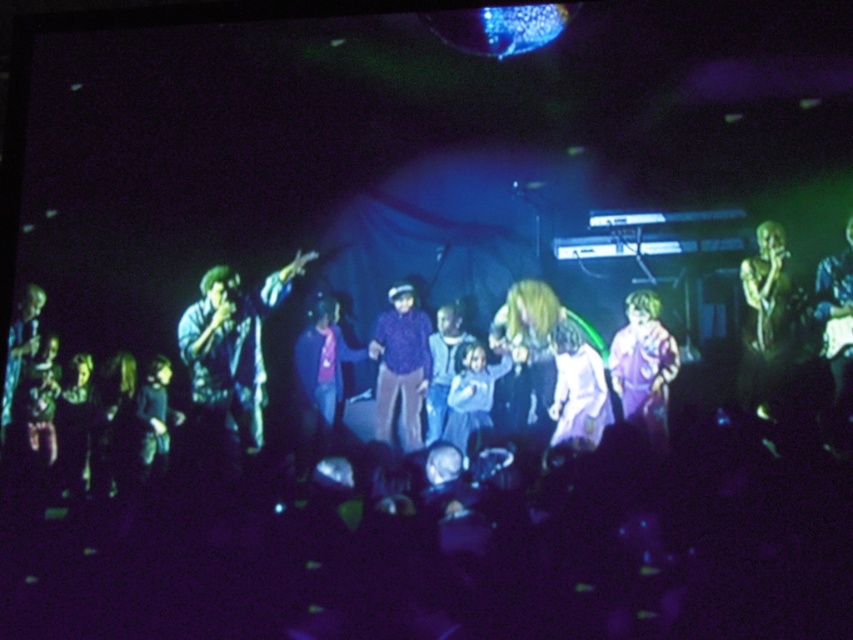
Question: Is shiny gold microphone at right further to camera compared to white fabric dress at center?

Choices:
 (A) no
 (B) yes

Answer: (A)

Question: Does purple cotton shirt at center appear over white fabric dress at center?

Choices:
 (A) no
 (B) yes

Answer: (B)

Question: Which object appears closest to the camera in this image?

Choices:
 (A) purple fabric at center
 (B) purple cotton shirt at center
 (C) purple matte shirt at center
 (D) shiny gold microphone at right

Answer: (D)

Question: Is purple matte shirt at center positioned at the back of light blue fabric at center?

Choices:
 (A) yes
 (B) no

Answer: (A)

Question: Which object is the closest to the purple matte shirt at center?

Choices:
 (A) white fabric dress at center
 (B) purple cotton shirt at center
 (C) shiny gold microphone at right

Answer: (B)

Question: Which of the following is the farthest from the observer?

Choices:
 (A) (595, 424)
 (B) (436, 413)
 (C) (619, 352)
 (D) (325, 346)

Answer: (D)